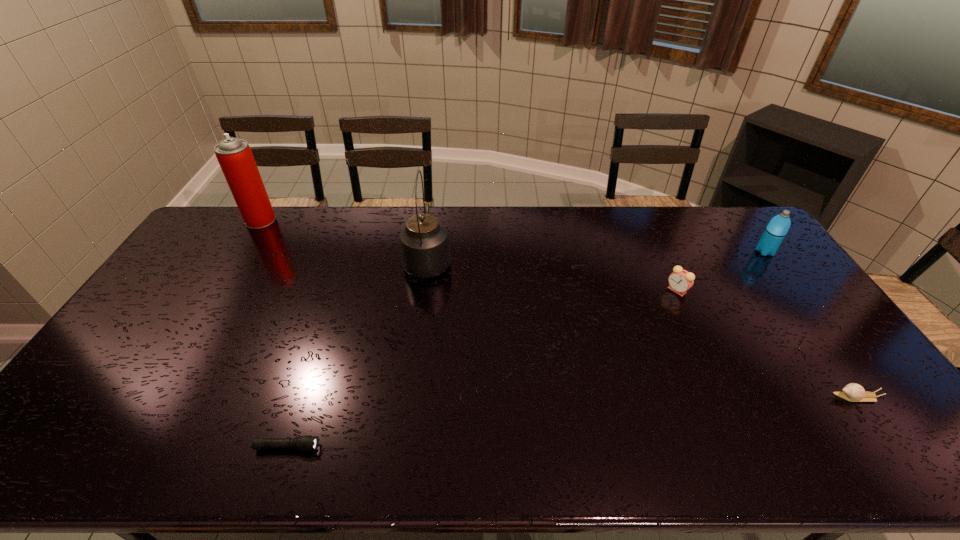
Locate an element on the screen. vacant space located 0.200m on the right of the aerosol can is located at coordinates (327, 220).

Identify the location of blank space located 0.090m spout on the third object from left to right. (432, 225).

Identify the location of free space located 0.160m spout on the third object from left to right. (434, 214).

Locate an element on the screen. vacant area situated 0.110m spout on the third object from left to right is located at coordinates coord(433,221).

Find the location of a particular element. Image resolution: width=960 pixels, height=540 pixels. vacant space located 0.200m on the front of the fourth shortest object is located at coordinates [800, 299].

This screenshot has width=960, height=540. I want to click on vacant region located 0.370m on the face of the alarm clock, so click(x=551, y=290).

This screenshot has height=540, width=960. Find the location of `free point located on the face of the alarm clock`. free point located on the face of the alarm clock is located at coordinates (638, 290).

Find the location of a particular element. vacant space located 0.070m on the face of the alarm clock is located at coordinates (645, 290).

Image resolution: width=960 pixels, height=540 pixels. In order to click on vacant space located 0.130m on the shell of the second nearest object in this screenshot , I will do `click(784, 397)`.

Where is `vacant region located on the shell of the second nearest object`? Image resolution: width=960 pixels, height=540 pixels. vacant region located on the shell of the second nearest object is located at coordinates pyautogui.click(x=764, y=397).